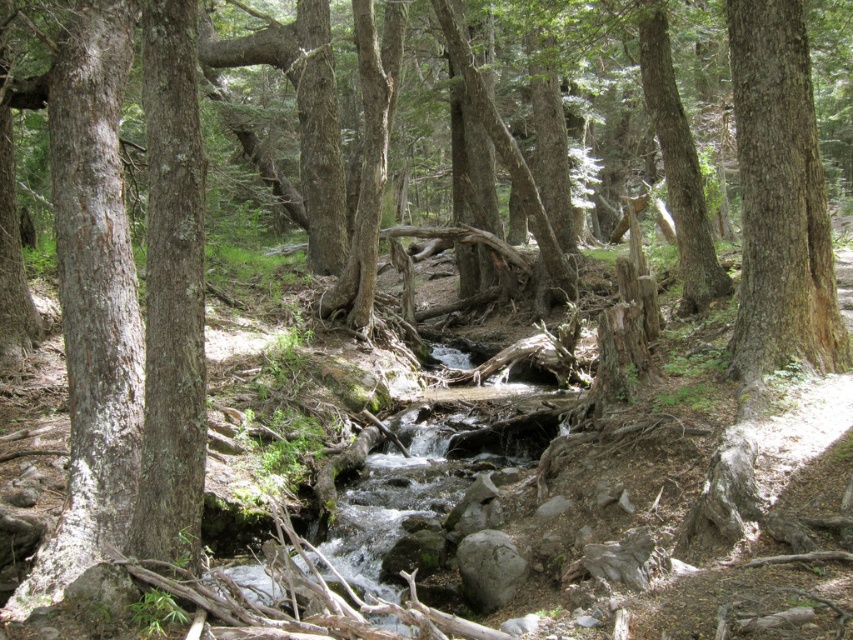
Question: Which of the following is the closest to the observer?

Choices:
 (A) (469, 541)
 (B) (782, 269)

Answer: (A)

Question: Which object appears closest to the camera in this image?

Choices:
 (A) smooth bark tree at center
 (B) gray rough rock at center

Answer: (B)

Question: Does smooth bark tree at center have a lesser width compared to gray rough rock at center?

Choices:
 (A) yes
 (B) no

Answer: (B)

Question: Considering the relative positions of smooth bark tree at center and gray rough rock at center in the image provided, where is smooth bark tree at center located with respect to gray rough rock at center?

Choices:
 (A) right
 (B) left

Answer: (A)

Question: Is smooth bark tree at center positioned behind gray rough rock at center?

Choices:
 (A) yes
 (B) no

Answer: (A)

Question: Which point is closer to the camera?

Choices:
 (A) smooth bark tree at center
 (B) gray rough rock at center

Answer: (B)